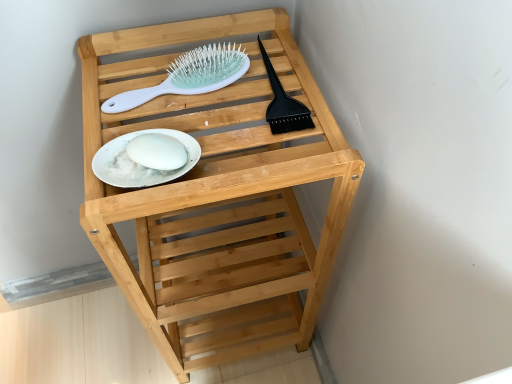
Question: Is natural wood shelf at center positioned with its back to white glossy plate at center?

Choices:
 (A) yes
 (B) no

Answer: (B)

Question: From a real-world perspective, is natural wood shelf at center located higher than white glossy plate at center?

Choices:
 (A) yes
 (B) no

Answer: (B)

Question: Does natural wood shelf at center touch white glossy plate at center?

Choices:
 (A) no
 (B) yes

Answer: (A)

Question: Is natural wood shelf at center shorter than white glossy plate at center?

Choices:
 (A) yes
 (B) no

Answer: (B)

Question: Would you say natural wood shelf at center contains white glossy plate at center?

Choices:
 (A) no
 (B) yes

Answer: (B)

Question: Is natural wood shelf at center to the right of white glossy plate at center from the viewer's perspective?

Choices:
 (A) no
 (B) yes

Answer: (B)

Question: Is white glossy plate at center thinner than white plastic hairbrush at upper center?

Choices:
 (A) no
 (B) yes

Answer: (B)

Question: Is white glossy plate at center at the left side of white plastic hairbrush at upper center?

Choices:
 (A) no
 (B) yes

Answer: (B)

Question: Considering the relative sizes of white glossy plate at center and white plastic hairbrush at upper center in the image provided, is white glossy plate at center smaller than white plastic hairbrush at upper center?

Choices:
 (A) no
 (B) yes

Answer: (B)

Question: Is white glossy plate at center oriented towards white plastic hairbrush at upper center?

Choices:
 (A) yes
 (B) no

Answer: (B)

Question: Can you confirm if white glossy plate at center is wider than white plastic hairbrush at upper center?

Choices:
 (A) yes
 (B) no

Answer: (B)

Question: Is white glossy plate at center outside white plastic hairbrush at upper center?

Choices:
 (A) no
 (B) yes

Answer: (B)

Question: Is the position of white glossy plate at center more distant than that of natural wood shelf at center?

Choices:
 (A) yes
 (B) no

Answer: (A)